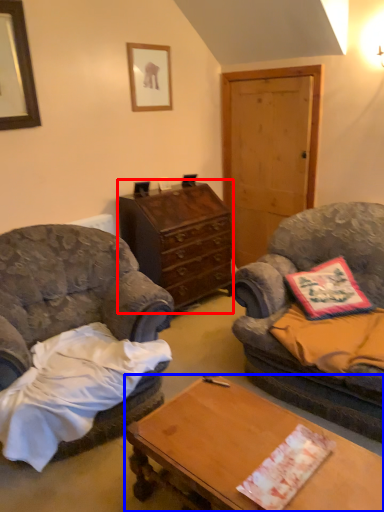
Question: Among these objects, which one is farthest to the camera, cabinetry (highlighted by a red box) or desk (highlighted by a blue box)?

Choices:
 (A) cabinetry
 (B) desk

Answer: (A)